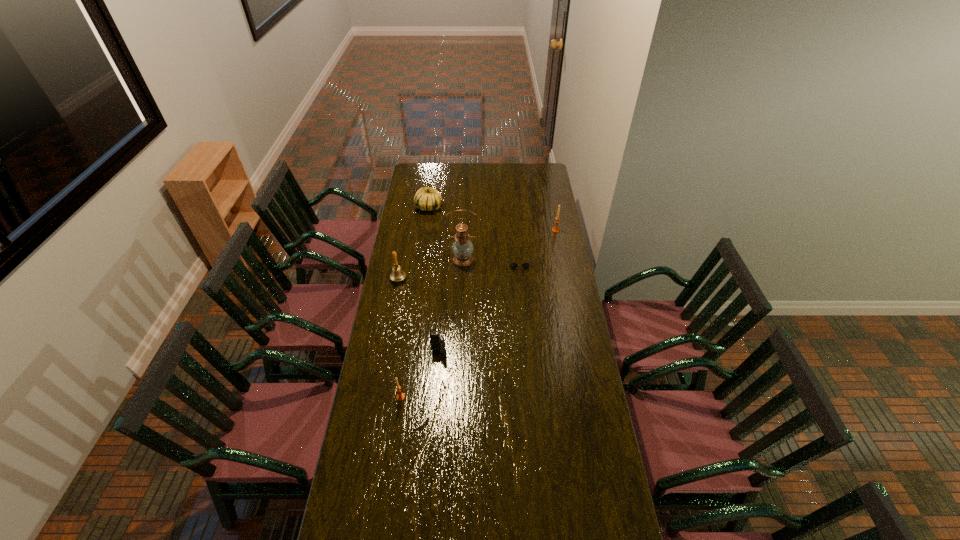
Where is `object located at the right edge`? The height and width of the screenshot is (540, 960). object located at the right edge is located at coordinates (555, 229).

In the image, there is a desktop. In order to click on vacant space at the far edge in this screenshot , I will do [x=451, y=168].

In the image, there is a desktop. Identify the location of vacant space at the near edge. pyautogui.click(x=535, y=506).

At what (x,y) coordinates should I click in order to perform the action: click on vacant space at the left edge of the desktop. Please return your answer as a coordinate pair (x, y). This screenshot has width=960, height=540. Looking at the image, I should click on (392, 352).

Identify the location of free spot at the right edge of the desktop. (555, 200).

Identify the location of free spot between the sunglasses and the nearest object. (460, 329).

You are a GUI agent. You are given a task and a screenshot of the screen. Output one action in this format:
    pyautogui.click(x=<x>, y=<y>)
    Task: Click on the free space between the farther candle_holder and the sixth object from left to right
    
    Given the screenshot: What is the action you would take?
    pyautogui.click(x=538, y=245)

The width and height of the screenshot is (960, 540). I want to click on vacant area that lies between the gourd and the right candle_holder, so click(492, 219).

Image resolution: width=960 pixels, height=540 pixels. Find the location of `unoccupied position between the rightmost object and the cellular telephone`. unoccupied position between the rightmost object and the cellular telephone is located at coordinates [497, 292].

The height and width of the screenshot is (540, 960). Identify the location of blank region between the gourd and the nearest object. (415, 302).